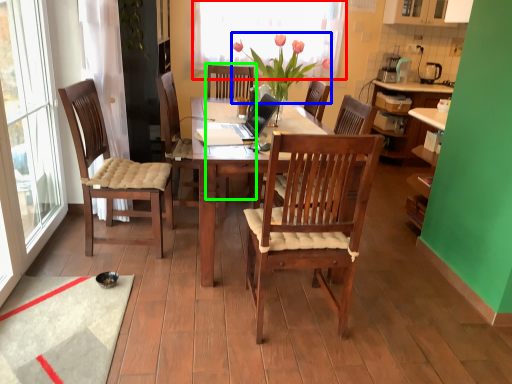
Question: Estimate the real-world distances between objects in this image. Which object is farther from window screen (highlighted by a red box), flower (highlighted by a blue box) or armchair (highlighted by a green box)?

Choices:
 (A) flower
 (B) armchair

Answer: (A)